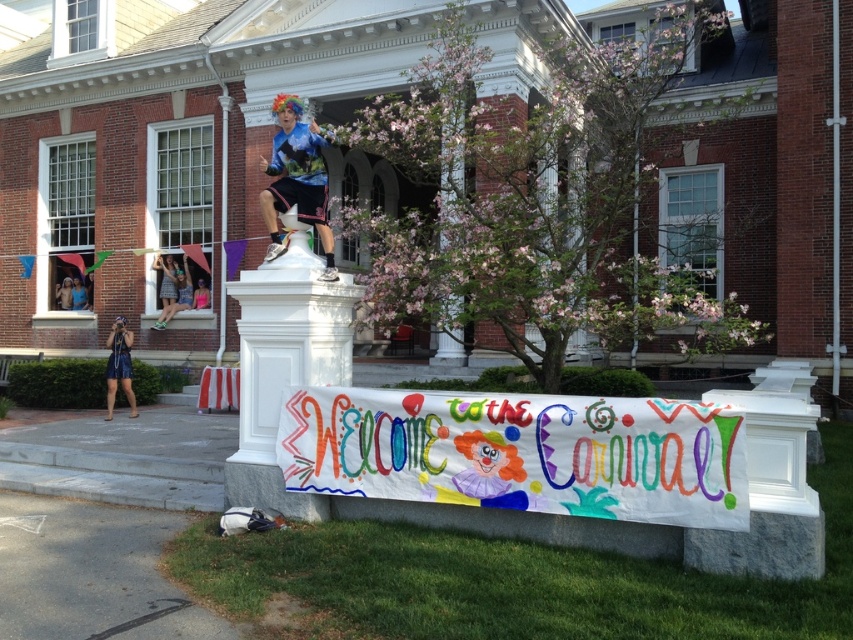
Question: Among these objects, which one is nearest to the camera?

Choices:
 (A) matte blue shirt at center
 (B) shiny silver helmet at upper center

Answer: (A)

Question: Which object is the farthest from the shiny silver helmet at upper center?

Choices:
 (A) matte blue shirt at center
 (B) blue denim shorts at center

Answer: (A)

Question: Does matte blue shirt at center appear on the right side of shiny silver helmet at upper center?

Choices:
 (A) no
 (B) yes

Answer: (B)

Question: Which object appears farthest from the camera in this image?

Choices:
 (A) shiny silver helmet at upper center
 (B) blue denim shorts at center
 (C) matte blue shirt at center
 (D) blue denim dress at lower left

Answer: (A)

Question: Is blue denim dress at lower left behind blue denim shorts at center?

Choices:
 (A) no
 (B) yes

Answer: (A)

Question: Can you confirm if blue denim dress at lower left is positioned below shiny silver helmet at upper center?

Choices:
 (A) yes
 (B) no

Answer: (A)